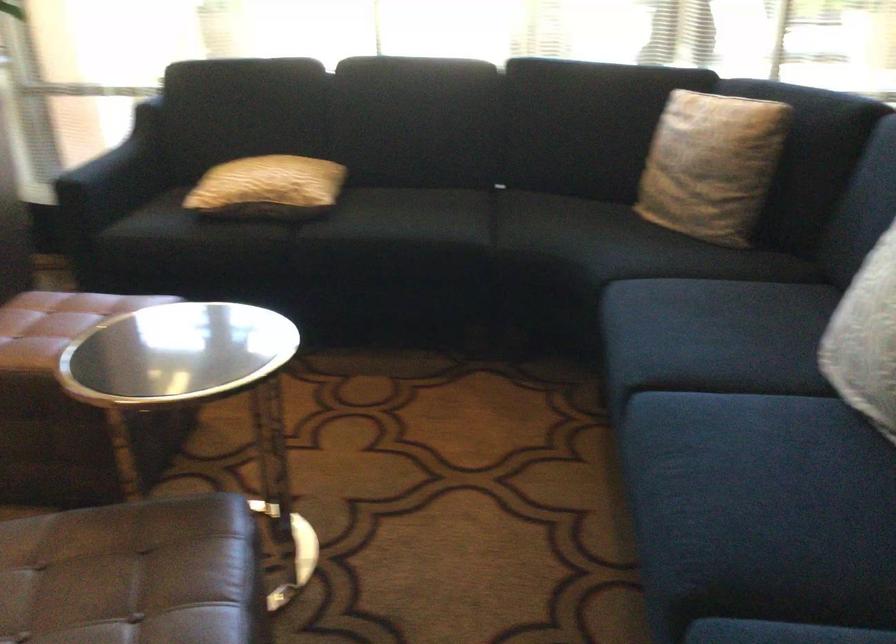
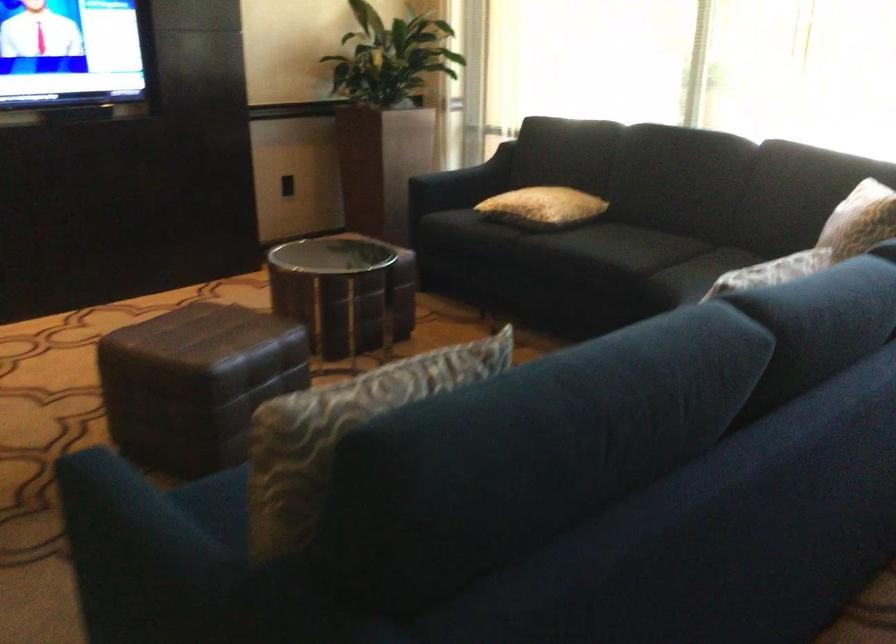
In the second image, find the point that corresponds to [459,225] in the first image.

(626, 254)